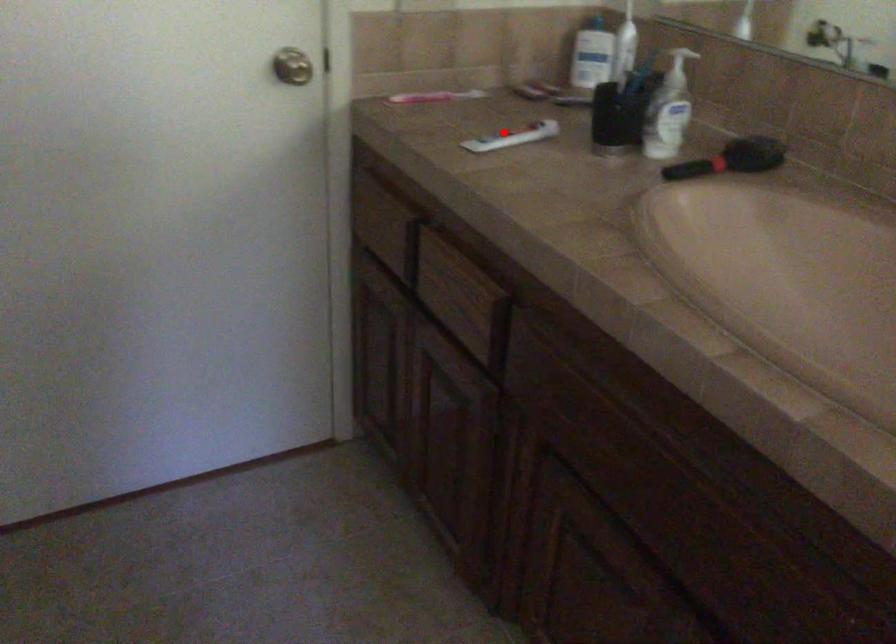
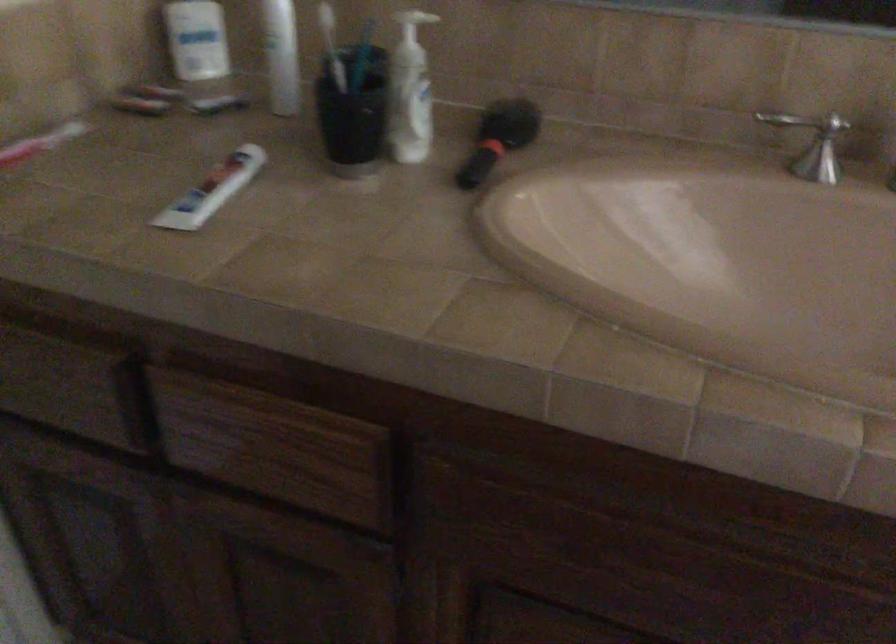
Question: I am providing you with two images of the same scene from different viewpoints. In image1, a red point is highlighted. Considering the same 3D point in image2, which of the following is correct?

Choices:
 (A) It is closer
 (B) It is farther

Answer: (A)